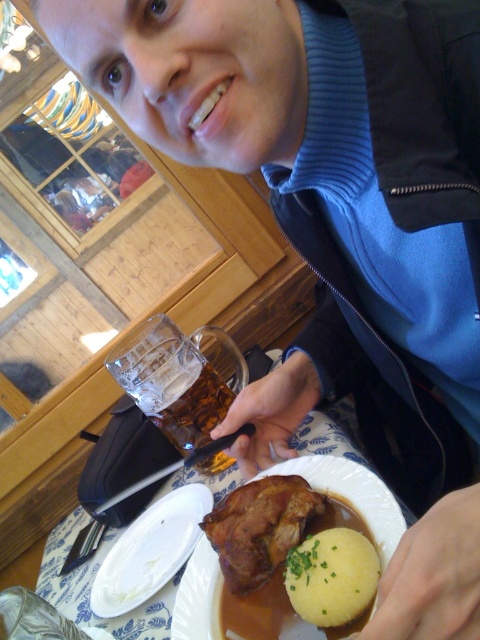
You are a waiter trying to place two small dishes on the table. The first dish must be placed at point [193,592] and the second at point [207,403]. Which point is closer to the customer sitting at the table?

Point [193,592] is closer to the customer than point [207,403] because it is closer to the viewer.

Consider the image. You are a server at the restaurant and need to place a new dish on the table. The dish is too hot to handle, so you want to place it on the surface closest to you. Which object should you choose between the matte brown plate at center and the translucent glass mug at lower center?

The matte brown plate at center is closer to the viewer than the translucent glass mug at lower center, so you should place the hot dish on the matte brown plate at center.

You are a server in a restaurant and need to place a new dish on the table. The table has a white matte plate at lower left. Where should you place the new dish to avoid overlapping with the existing plate?

The white matte plate at lower left is located at point [149,550], so you should place the new dish elsewhere on the table to avoid overlapping with it.